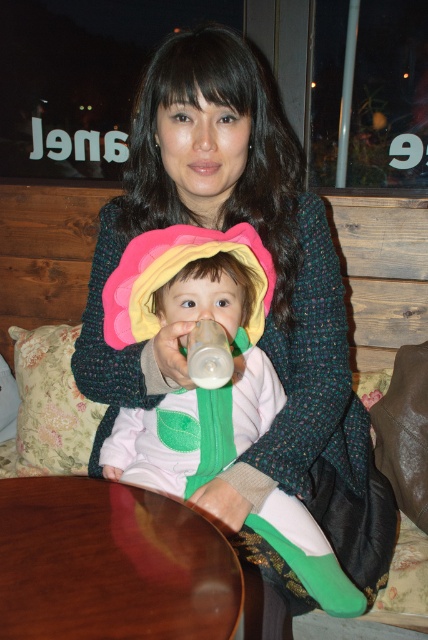
You are a photographer trying to capture the soft pink fabric flower at center and the shiny brown wood at lower center in a single shot. Based on their positions, which object should you focus on first to ensure both are in frame?

The soft pink fabric flower at center is located above the shiny brown wood at lower center, so you should focus on the shiny brown wood at lower center first to ensure both objects are within the frame.

You are a photographer setting up a shot of the scene described. You need to position a light source so it illuminates both the shiny brown wood at lower center and the transparent plastic bottle at center without creating harsh shadows. Given their height difference, where should you place the light source relative to the objects?

Since the shiny brown wood at lower center is taller than the transparent plastic bottle at center, placing the light source above both objects will ensure even illumination and minimize harsh shadows between them.

What is located at the point with coordinates (172, 326) in the image?

The point at coordinates (172, 326) is on the soft pink fabric flower at center.